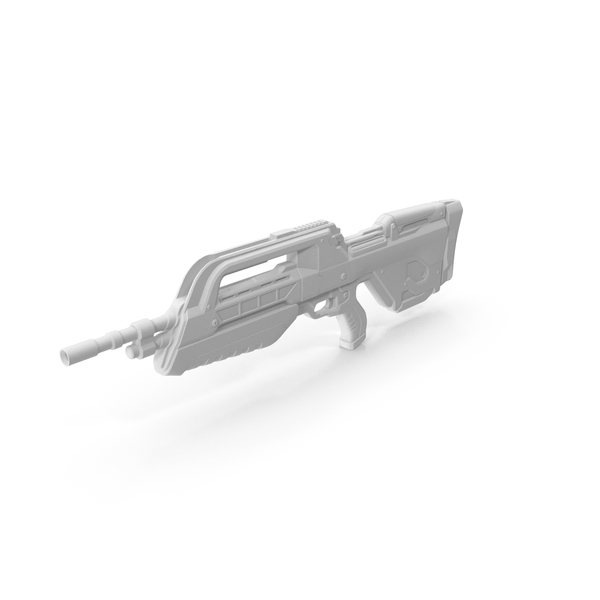
I want to click on handle, so click(354, 317).